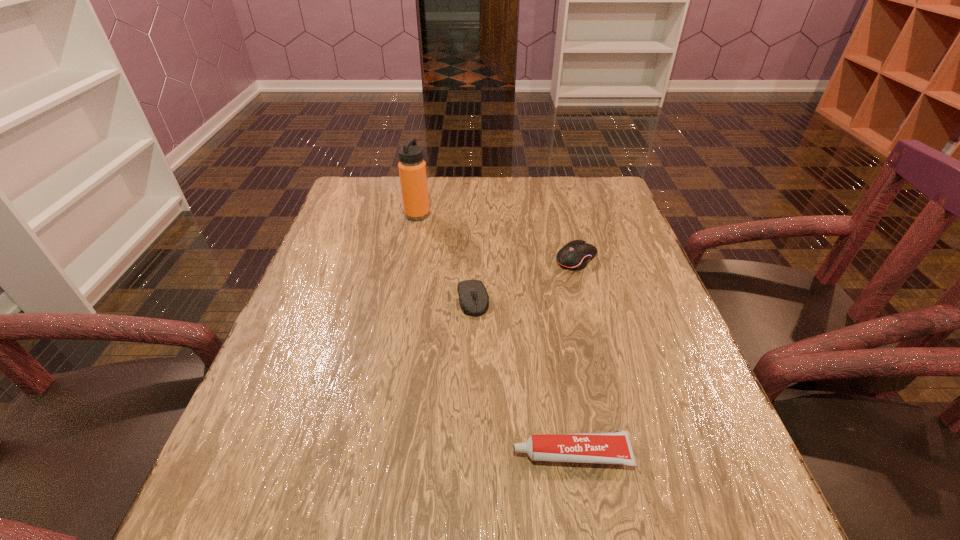
Choose which object is the second nearest neighbor to the third object from right to left. Please provide its 2D coordinates. Your answer should be formatted as a tuple, i.e. [(x, y)], where the tuple contains the x and y coordinates of a point satisfying the conditions above.

[(412, 168)]

Select which object is the third closest to the leftmost object. Please provide its 2D coordinates. Your answer should be formatted as a tuple, i.e. [(x, y)], where the tuple contains the x and y coordinates of a point satisfying the conditions above.

[(605, 447)]

Identify the location of vacant space that satisfies the following two spatial constraints: 1. on the front side of the tallest object; 2. on the right side of the second tallest object. This screenshot has width=960, height=540. (409, 258).

I want to click on vacant space that satisfies the following two spatial constraints: 1. on the front side of the second object from left to right; 2. on the right side of the tallest object, so click(400, 300).